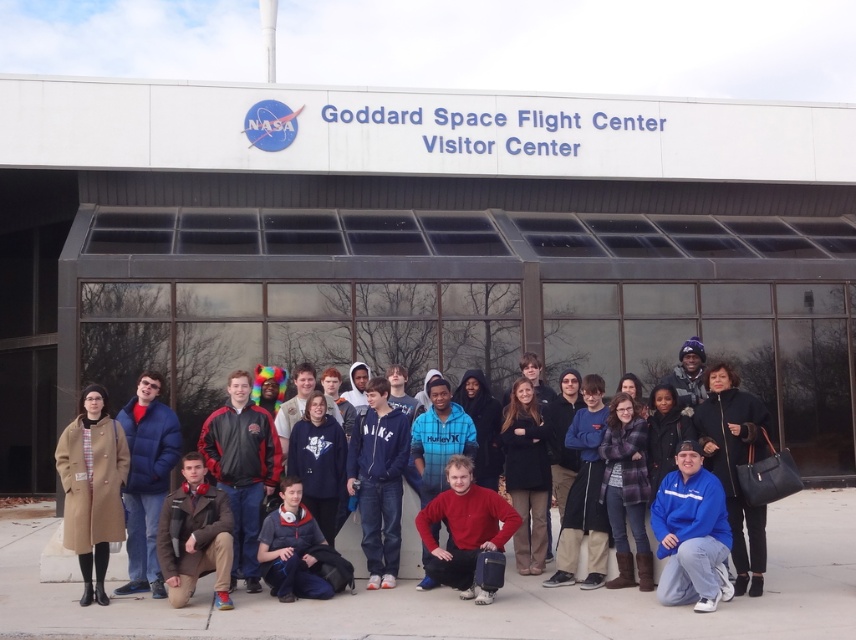
Question: Which of these objects is positioned closest to the blue puffy jacket at center?

Choices:
 (A) red matte sweater at lower center
 (B) blue fleece jacket at lower right
 (C) dark brown leather jacket at center
 (D) brown leather jacket at lower left

Answer: (D)

Question: From the image, what is the correct spatial relationship of blue fleece jacket at lower right in relation to red matte sweater at lower center?

Choices:
 (A) below
 (B) above

Answer: (B)

Question: Which point is closer to the camera?

Choices:
 (A) blue puffy jacket at center
 (B) blue fleece jacket at lower right
 (C) red matte sweater at lower center

Answer: (B)

Question: Does blue fleece jacket at lower right appear over blue puffy jacket at center?

Choices:
 (A) yes
 (B) no

Answer: (B)

Question: Is dark brown leather jacket at center above red matte sweater at lower center?

Choices:
 (A) no
 (B) yes

Answer: (B)

Question: Which point appears closest to the camera in this image?

Choices:
 (A) (473, 509)
 (B) (152, 577)

Answer: (A)